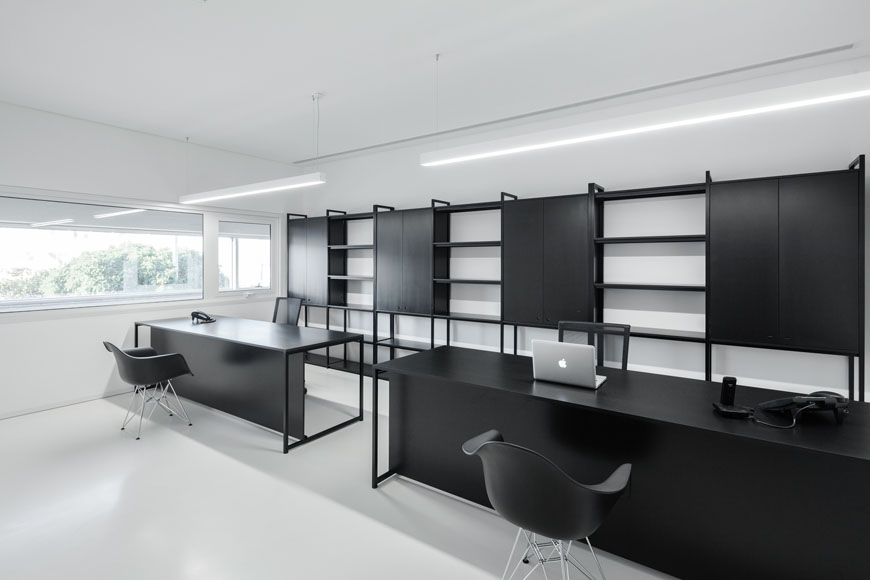
Where is `door cupboard`? Image resolution: width=870 pixels, height=580 pixels. door cupboard is located at coordinates (760, 293).